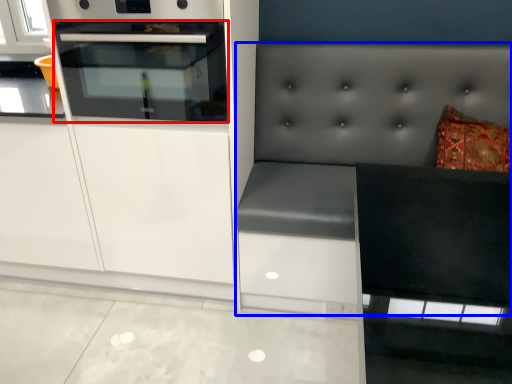
Question: Which object is closer to the camera taking this photo, oven (highlighted by a red box) or couch (highlighted by a blue box)?

Choices:
 (A) oven
 (B) couch

Answer: (B)